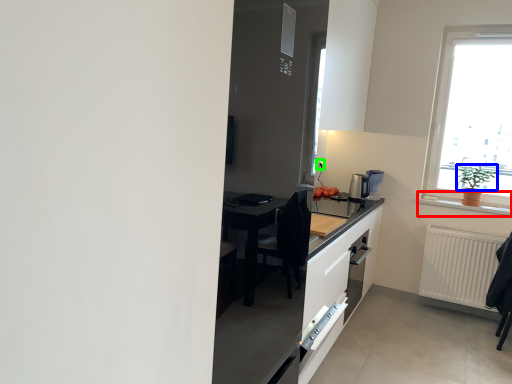
Question: Considering the real-world distances, which object is closest to window sill (highlighted by a red box)? plant (highlighted by a blue box) or electric outlet (highlighted by a green box).

Choices:
 (A) plant
 (B) electric outlet

Answer: (A)